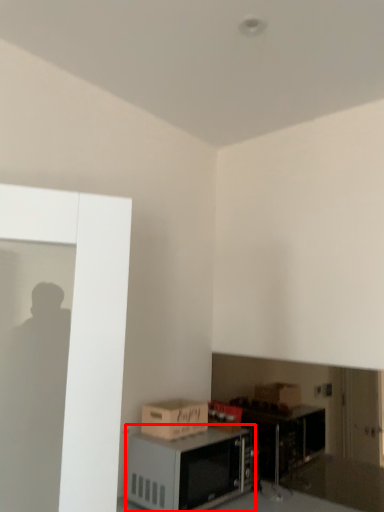
Question: From the image's perspective, what is the correct spatial positioning of microwave (annotated by the red box) in reference to cardboard box?

Choices:
 (A) above
 (B) below

Answer: (B)